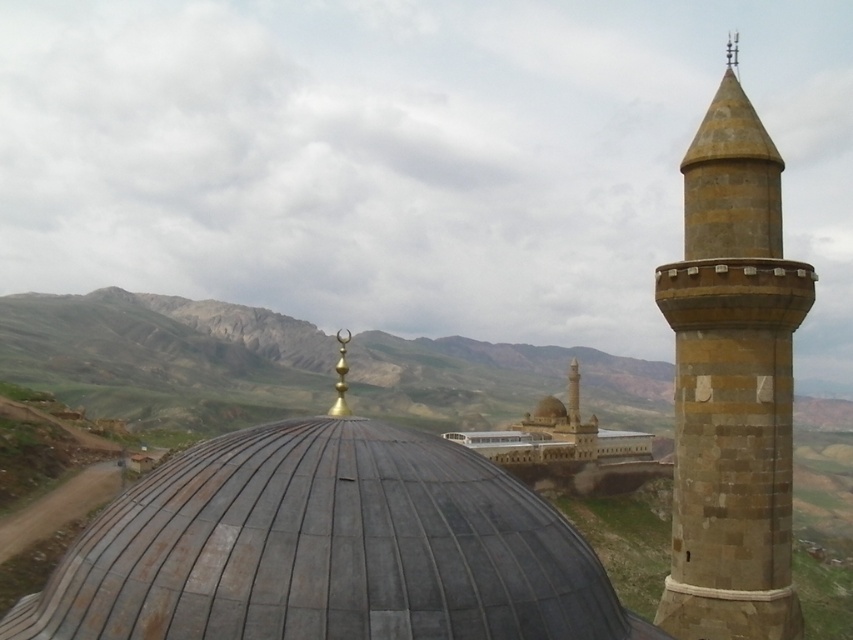
You are standing in the courtyard of the mosque and want to take a photo of both the gray tiled dome at center and the brown stone tower at right. Which object should you position closer to the camera to ensure both are in the frame?

You should position the gray tiled dome at center closer to the camera since it is already in front of the brown stone tower at right, allowing both to be captured in the same frame.

You are an architect analyzing the layout of this mosque complex. You notice the gray tiled dome at center and the brown stone tower at right. Which of these two structures is located more to the east if the image is oriented with north at the top?

The gray tiled dome at center is positioned on the left side of the brown stone tower at right. Since the image is oriented with north at the top, left would correspond to west and right to east. Therefore, the brown stone tower at right is located more to the east.

You are an architect examining the mosque complex. You notice the gray tiled dome at center and the brown stone tower at right. Which structure is located lower in the scene?

The gray tiled dome at center is positioned under the brown stone tower at right, so it is located lower in the scene.